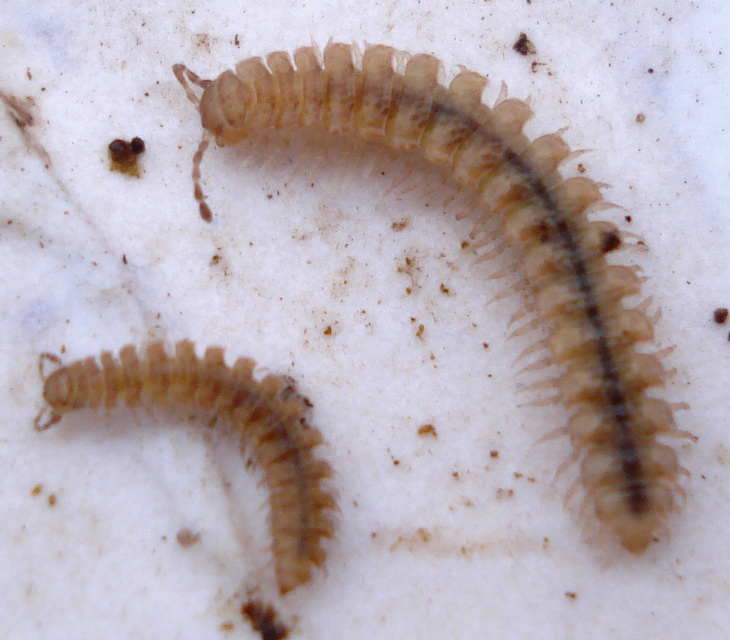
Is translucent beige centipede at center shorter than translucent beige centipede at lower left?

In fact, translucent beige centipede at center may be taller than translucent beige centipede at lower left.

Between translucent beige centipede at center and translucent beige centipede at lower left, which one has less height?

translucent beige centipede at lower left

Is point (622, 488) farther from viewer compared to point (296, 547)?

No.

You are a GUI agent. You are given a task and a screenshot of the screen. Output one action in this format:
    pyautogui.click(x=<x>, y=<y>)
    Task: Click on the translucent beige centipede at center
    
    Given the screenshot: What is the action you would take?
    pyautogui.click(x=488, y=237)